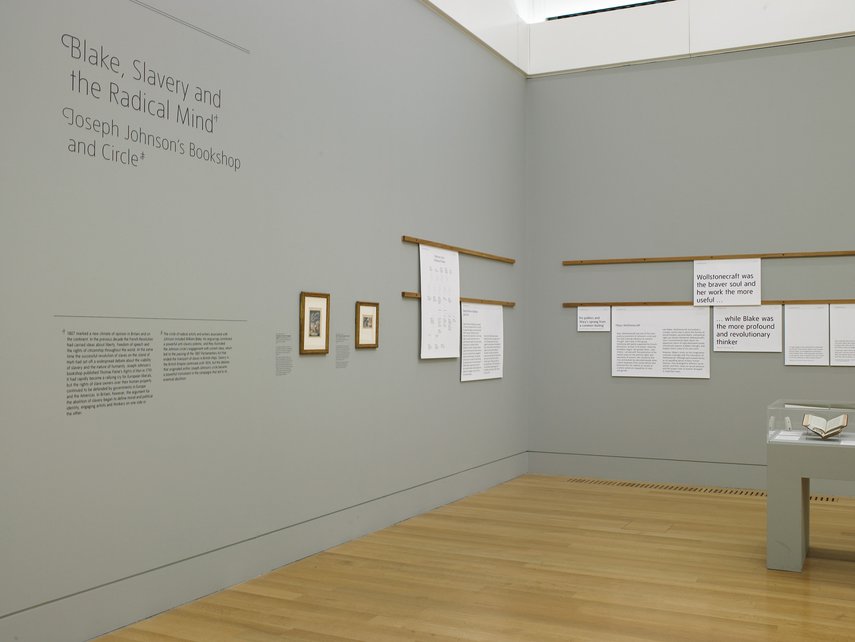
In order to click on 1 right wall in this screenshot , I will do `click(770, 171)`.